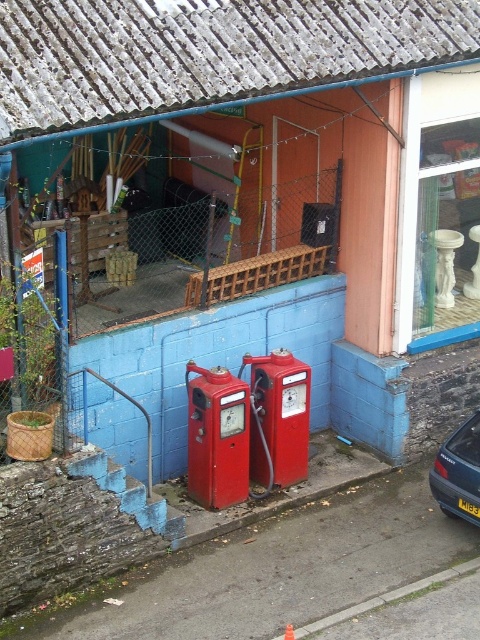
In the scene shown: Does blue metallic car at lower right lie behind black plastic license plate at lower center?

No.

Between blue metallic car at lower right and black plastic license plate at lower center, which one is positioned lower?

black plastic license plate at lower center

Is point (465, 500) farther from viewer compared to point (467, 513)?

No.

Image resolution: width=480 pixels, height=640 pixels. I want to click on blue metallic car at lower right, so click(x=458, y=472).